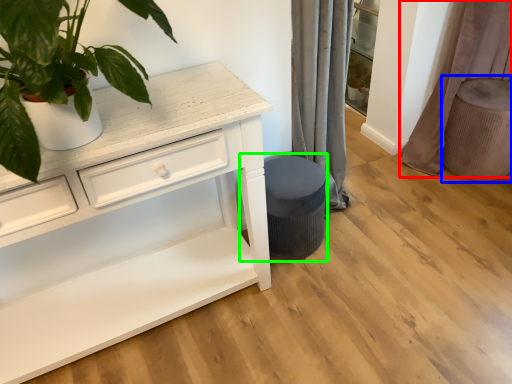
Question: Based on their relative distances, which object is farther from curtain (highlighted by a red box)? Choose from swivel chair (highlighted by a blue box) and music stool (highlighted by a green box).

Choices:
 (A) swivel chair
 (B) music stool

Answer: (B)